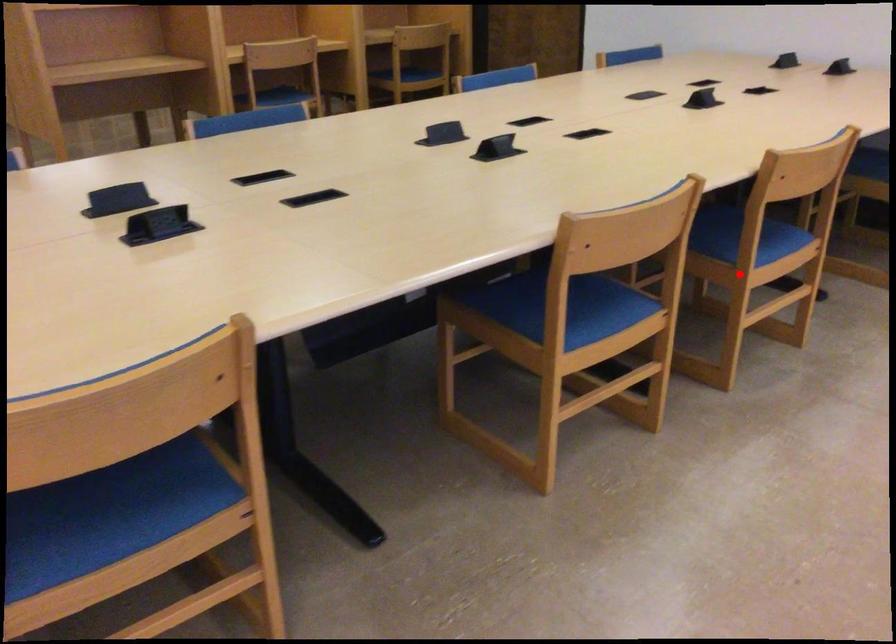
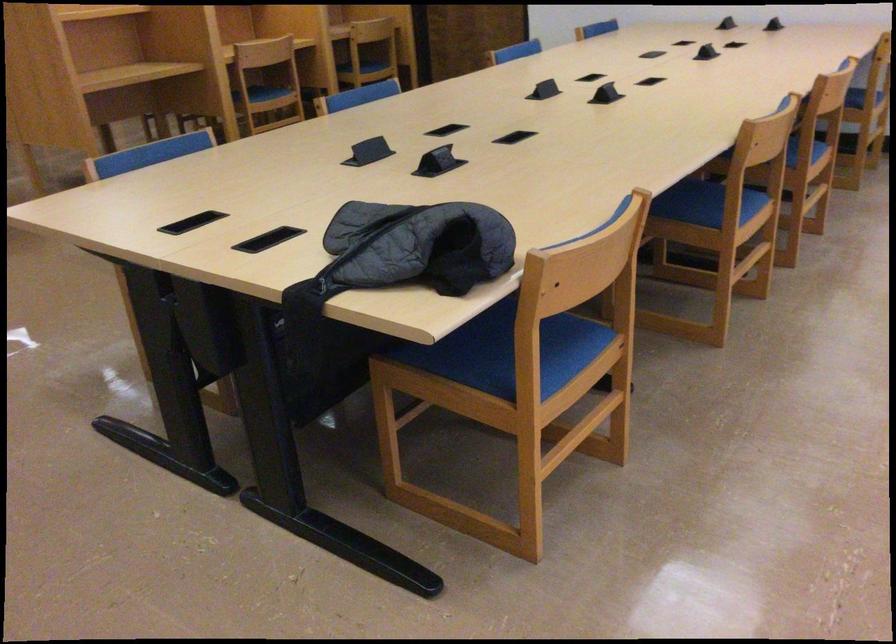
Question: A red point is marked in image1. In image2, is the corresponding 3D point closer to the camera or farther? Reply with the corresponding letter.

Choices:
 (A) The corresponding 3D point is closer.
 (B) The corresponding 3D point is farther.

Answer: (B)